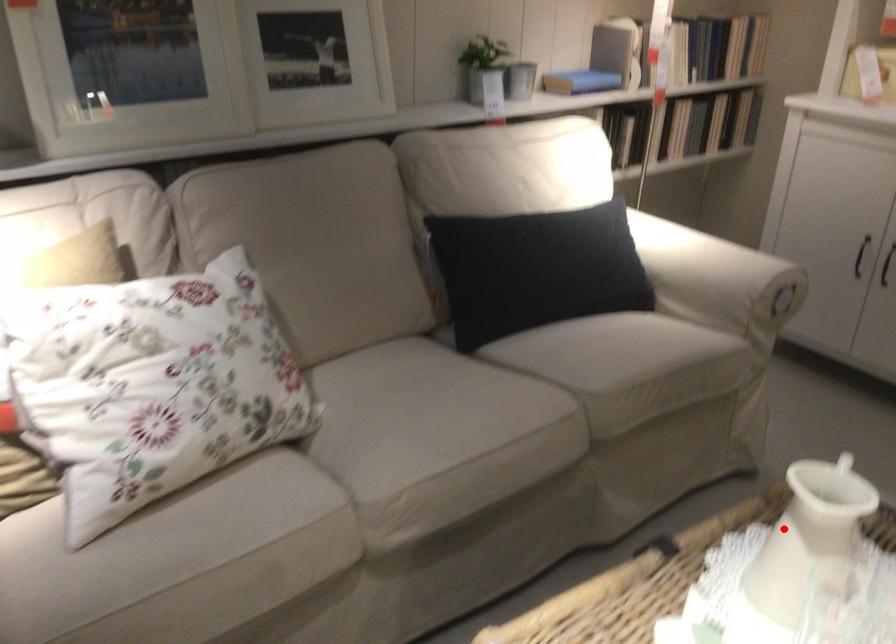
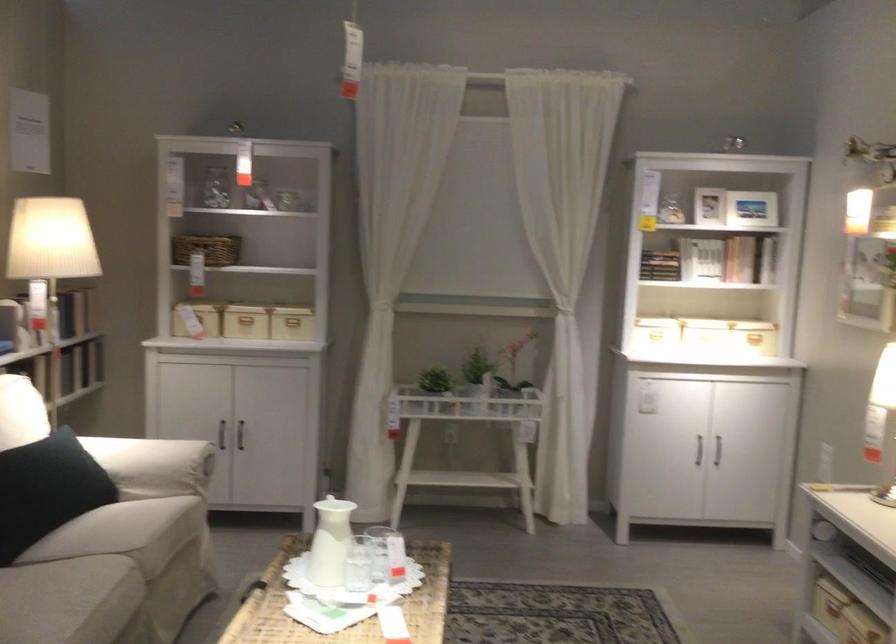
Question: I am providing you with two images of the same scene from different viewpoints. Image1 has a red point marked. In image2, the corresponding 3D location appears at what relative position? Reply with the corresponding letter.

Choices:
 (A) Closer
 (B) Farther

Answer: (B)